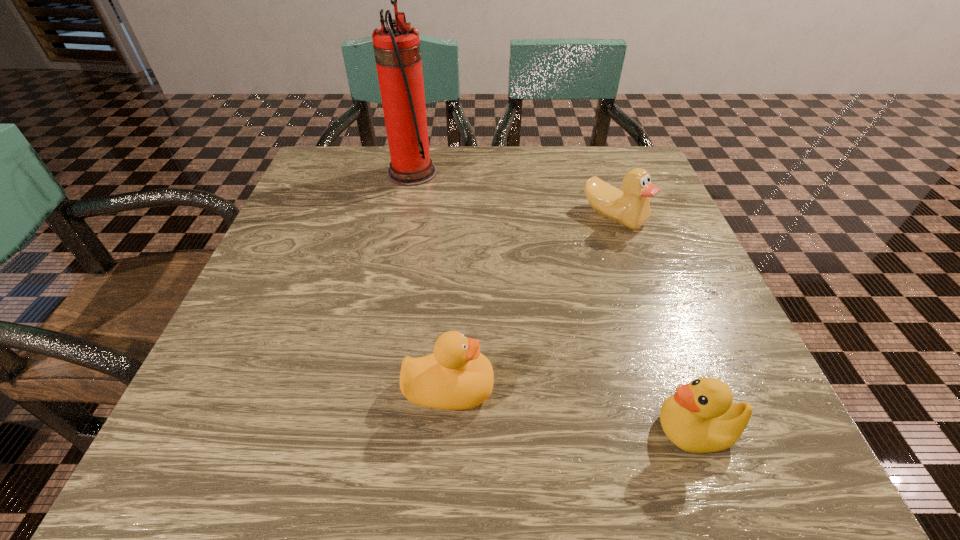
I want to click on object that is positioned at the near right corner, so click(x=701, y=417).

Where is `vacant region at the far edge of the desktop`? This screenshot has height=540, width=960. vacant region at the far edge of the desktop is located at coordinates (558, 194).

At what (x,y) coordinates should I click in order to perform the action: click on blank area at the near edge. Please return your answer as a coordinate pair (x, y). The height and width of the screenshot is (540, 960). Looking at the image, I should click on (606, 458).

The width and height of the screenshot is (960, 540). Find the location of `vacant space at the left edge`. vacant space at the left edge is located at coordinates [x=334, y=266].

Where is `vacant point at the right edge`? vacant point at the right edge is located at coordinates (766, 395).

In order to click on vacant space at the far left corner of the desktop in this screenshot , I will do `click(373, 157)`.

Where is `vacant space in between the farthest duck and the tallest object`? This screenshot has height=540, width=960. vacant space in between the farthest duck and the tallest object is located at coordinates (513, 194).

Locate an element on the screen. The height and width of the screenshot is (540, 960). vacant space in between the leftmost duck and the tallest object is located at coordinates (430, 280).

This screenshot has width=960, height=540. In order to click on free space between the farthest object and the third nearest object in this screenshot , I will do `click(513, 194)`.

Where is `vacant area that lies between the farthest object and the leftmost duck`? The width and height of the screenshot is (960, 540). vacant area that lies between the farthest object and the leftmost duck is located at coordinates (430, 280).